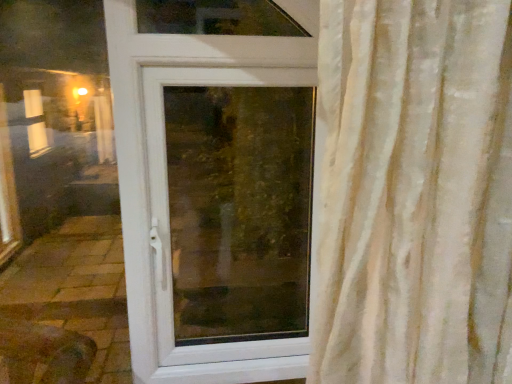
Question: Is point (243, 253) closer or farther from the camera than point (250, 364)?

Choices:
 (A) closer
 (B) farther

Answer: (B)

Question: From their relative heights in the image, would you say transparent glass window at center is taller or shorter than white plastic door at center?

Choices:
 (A) tall
 (B) short

Answer: (B)

Question: Is transparent glass window at center wider or thinner than white plastic door at center?

Choices:
 (A) thin
 (B) wide

Answer: (B)

Question: Would you say white plastic door at center is to the left or to the right of transparent glass window at center in the picture?

Choices:
 (A) right
 (B) left

Answer: (B)

Question: Which is correct: white plastic door at center is inside transparent glass window at center, or outside of it?

Choices:
 (A) inside
 (B) outside

Answer: (A)

Question: In terms of size, does white plastic door at center appear bigger or smaller than transparent glass window at center?

Choices:
 (A) big
 (B) small

Answer: (A)

Question: From the image's perspective, is white plastic door at center above or below transparent glass window at center?

Choices:
 (A) below
 (B) above

Answer: (B)